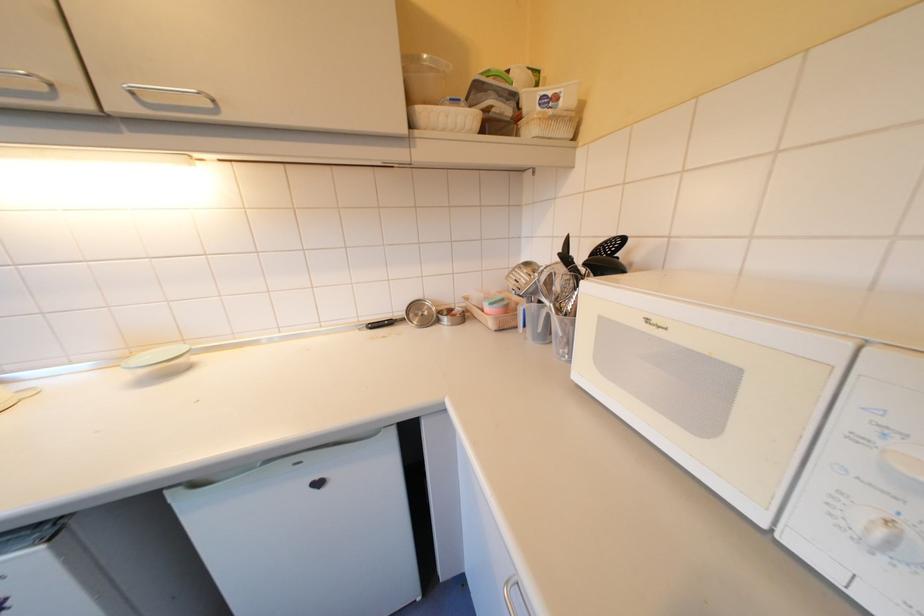
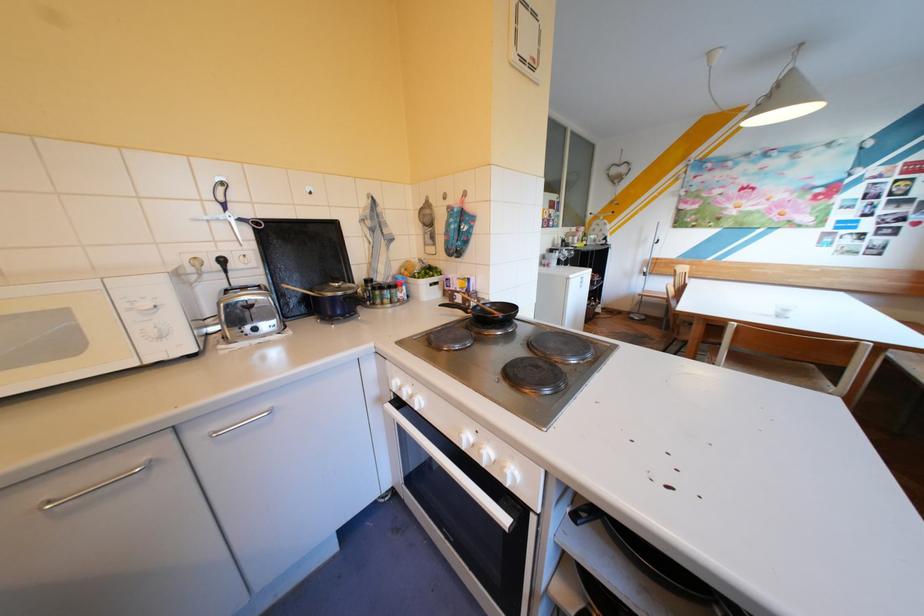
Find the pixel in the second image that matches point 872,438 in the first image.

(142, 309)